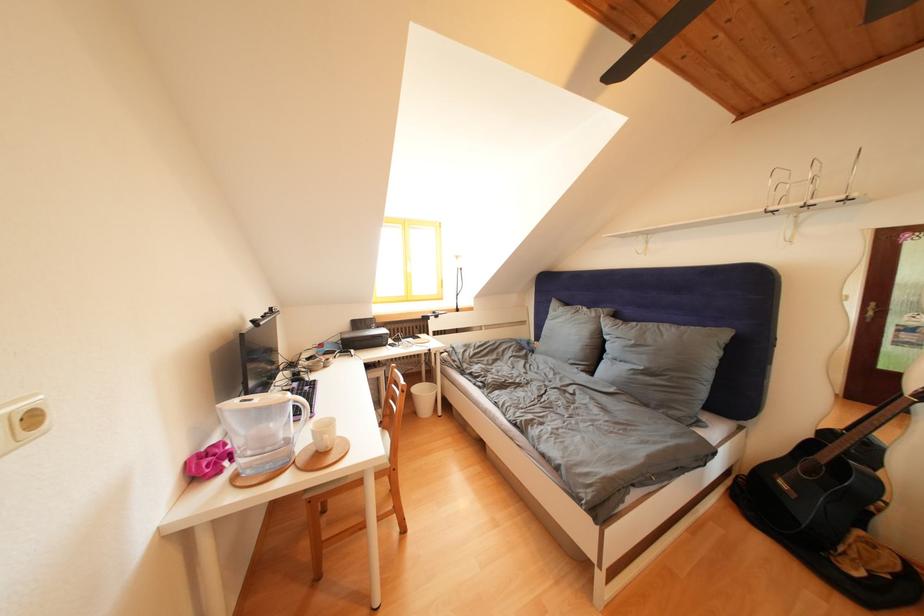
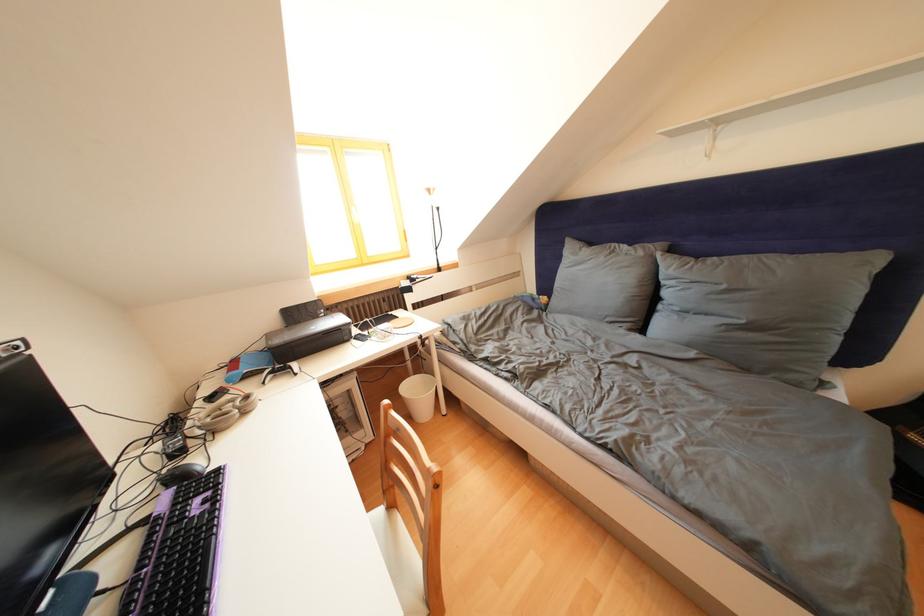
In a continuous first-person perspective shot, in which direction is the camera moving?

The cameraman walked toward left, forward.